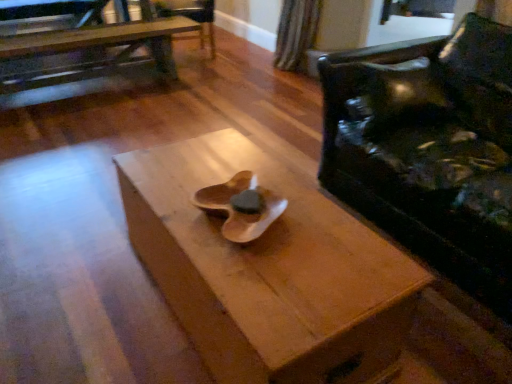
You are a GUI agent. You are given a task and a screenshot of the screen. Output one action in this format:
    pyautogui.click(x=<x>, y=<y>)
    Task: Click on the vacant space underneath wooden armchair at upper center (from a real-world perspective)
    Image resolution: width=512 pixels, height=384 pixels.
    Given the screenshot: What is the action you would take?
    pyautogui.click(x=201, y=56)